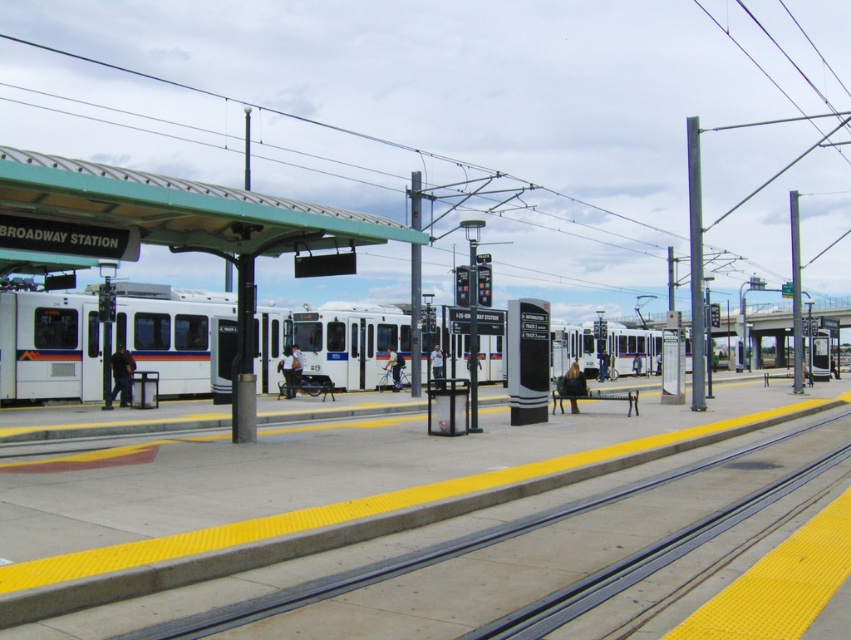
Question: Does light brown leather jacket at center have a smaller size compared to dark blue jeans at center?

Choices:
 (A) yes
 (B) no

Answer: (A)

Question: Which point appears closest to the camera in this image?

Choices:
 (A) (577, 369)
 (B) (289, 381)
 (C) (437, 376)

Answer: (A)

Question: Which point is farther to the camera?

Choices:
 (A) (287, 385)
 (B) (437, 369)
 (C) (577, 371)

Answer: (B)

Question: Which point is farther to the camera?

Choices:
 (A) light brown leather jacket at center
 (B) brown leather jacket at center
 (C) white matte train at left
 (D) blue jeans at center

Answer: (D)

Question: Is the position of brown leather jacket at center less distant than that of blue jeans at center?

Choices:
 (A) no
 (B) yes

Answer: (B)

Question: Is blue jeans at center below light blue shirt at center?

Choices:
 (A) no
 (B) yes

Answer: (B)